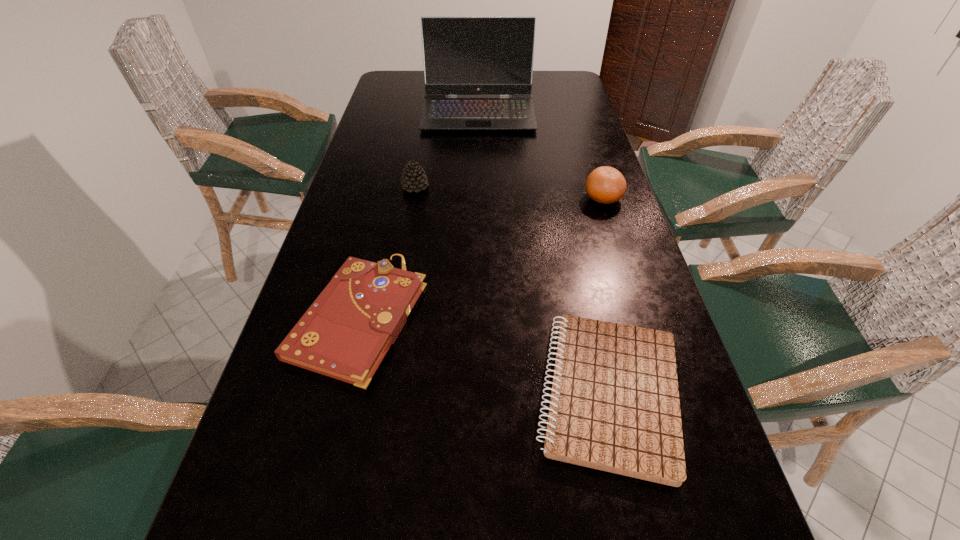
Where is `free region at the right edge of the desktop`? This screenshot has width=960, height=540. free region at the right edge of the desktop is located at coordinates (543, 106).

The width and height of the screenshot is (960, 540). I want to click on vacant space at the far left corner of the desktop, so click(x=420, y=94).

Locate an element on the screen. vacant space at the far right corner of the desktop is located at coordinates (559, 91).

Locate an element on the screen. The width and height of the screenshot is (960, 540). vacant space in between the tallest object and the taller notebook is located at coordinates (419, 215).

The image size is (960, 540). Identify the location of unoccupied position between the pinecone and the clementine. (509, 193).

Where is `vacant area that lies between the farthest object and the second shortest object`? vacant area that lies between the farthest object and the second shortest object is located at coordinates (419, 215).

Locate an element on the screen. vacant space that is in between the shorter notebook and the clementine is located at coordinates (606, 296).

Identify the location of free space between the laptop computer and the left notebook. (419, 215).

Where is `free space that is in between the shorter notebook and the laptop computer`? free space that is in between the shorter notebook and the laptop computer is located at coordinates (543, 253).

This screenshot has height=540, width=960. I want to click on blank region between the pinecone and the clementine, so click(509, 193).